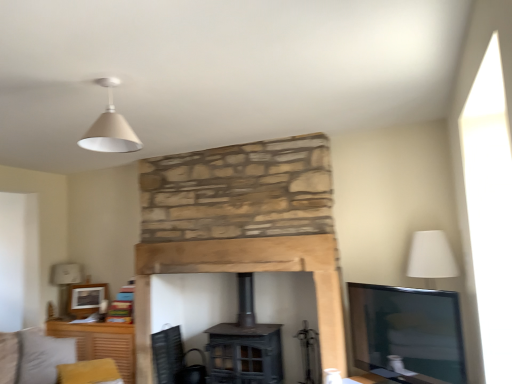
Question: Should I look upward or downward to see white fabric lampshade at left?

Choices:
 (A) down
 (B) up

Answer: (A)

Question: From the image's perspective, would you say black mesh swivel chair at lower left is positioned over matte wooden picture frame at upper left?

Choices:
 (A) yes
 (B) no

Answer: (B)

Question: Is black mesh swivel chair at lower left touching matte wooden picture frame at upper left?

Choices:
 (A) yes
 (B) no

Answer: (B)

Question: Is black mesh swivel chair at lower left at the right side of matte wooden picture frame at upper left?

Choices:
 (A) no
 (B) yes

Answer: (B)

Question: Can you confirm if black mesh swivel chair at lower left is taller than matte wooden picture frame at upper left?

Choices:
 (A) yes
 (B) no

Answer: (A)

Question: Is black mesh swivel chair at lower left not close to matte wooden picture frame at upper left?

Choices:
 (A) no
 (B) yes

Answer: (A)

Question: Does black mesh swivel chair at lower left have a greater width compared to matte wooden picture frame at upper left?

Choices:
 (A) yes
 (B) no

Answer: (A)

Question: Is matte wooden picture frame at upper left thinner than white fabric lampshade at left?

Choices:
 (A) no
 (B) yes

Answer: (B)

Question: Is matte wooden picture frame at upper left not within white fabric lampshade at left?

Choices:
 (A) yes
 (B) no

Answer: (A)

Question: Considering the relative sizes of matte wooden picture frame at upper left and white fabric lampshade at left in the image provided, is matte wooden picture frame at upper left wider than white fabric lampshade at left?

Choices:
 (A) yes
 (B) no

Answer: (B)

Question: Is matte wooden picture frame at upper left oriented away from white fabric lampshade at left?

Choices:
 (A) no
 (B) yes

Answer: (B)

Question: Can you confirm if matte wooden picture frame at upper left is shorter than white fabric lampshade at left?

Choices:
 (A) yes
 (B) no

Answer: (A)

Question: Does matte wooden picture frame at upper left touch white fabric lampshade at left?

Choices:
 (A) yes
 (B) no

Answer: (B)

Question: Is matte wooden picture frame at upper left located within matte white cone at upper center?

Choices:
 (A) no
 (B) yes

Answer: (A)